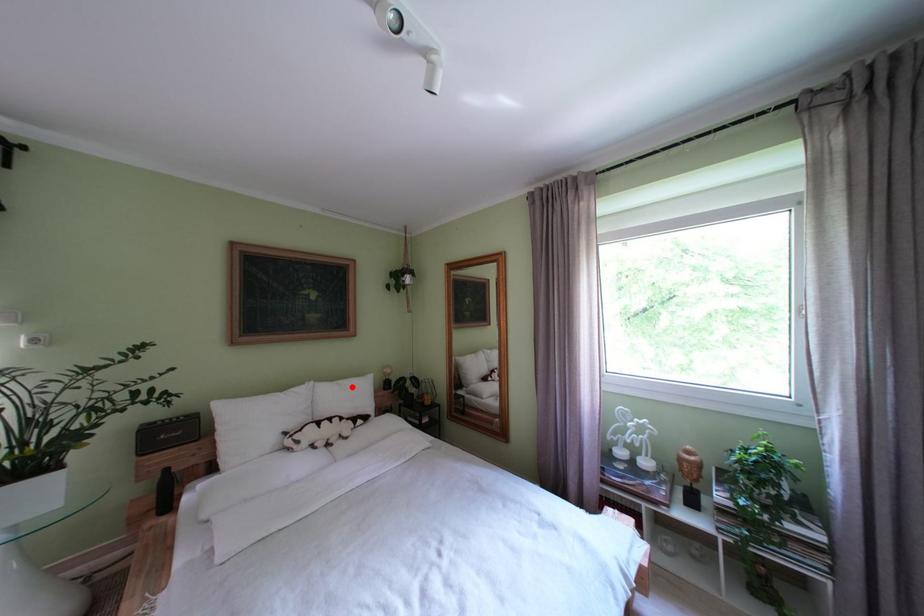
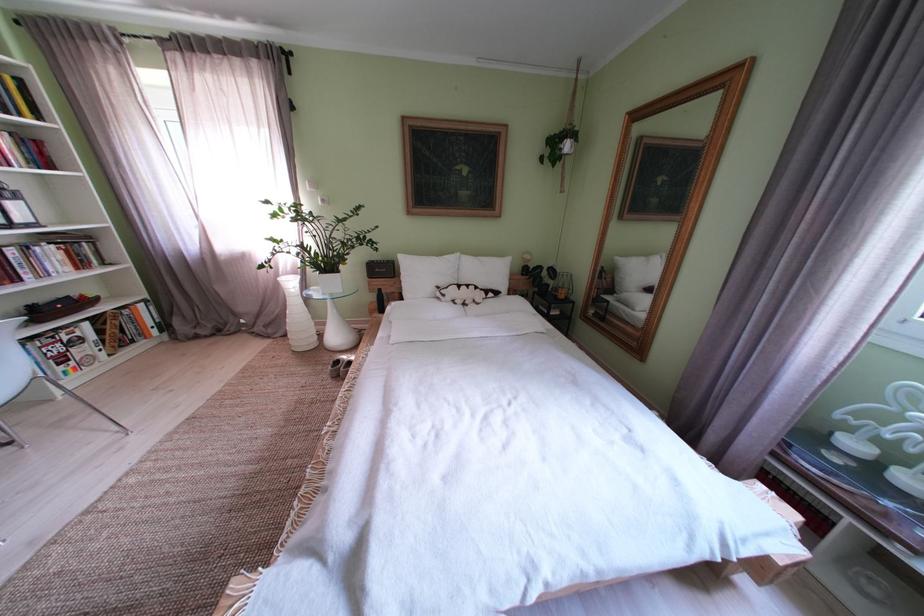
Where in the second image is the point corresponding to the highlighted location from the first image?

(492, 264)